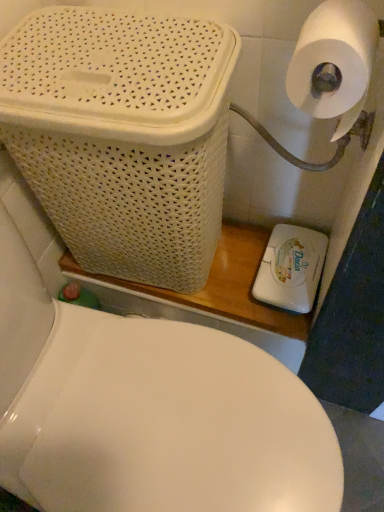
Image resolution: width=384 pixels, height=512 pixels. Find the location of `vacant space that is to the left of white plastic soap dispenser at lower right`. vacant space that is to the left of white plastic soap dispenser at lower right is located at coordinates (228, 279).